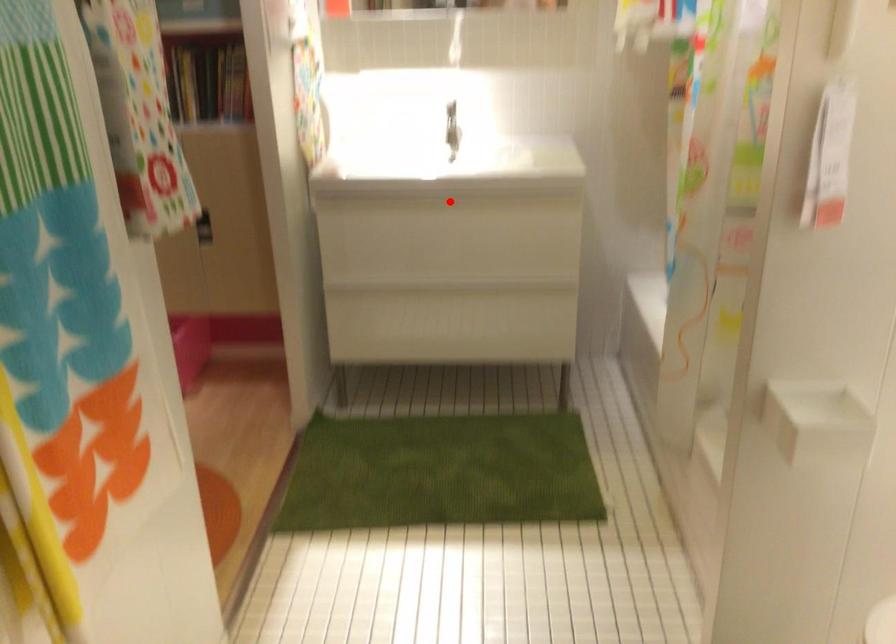
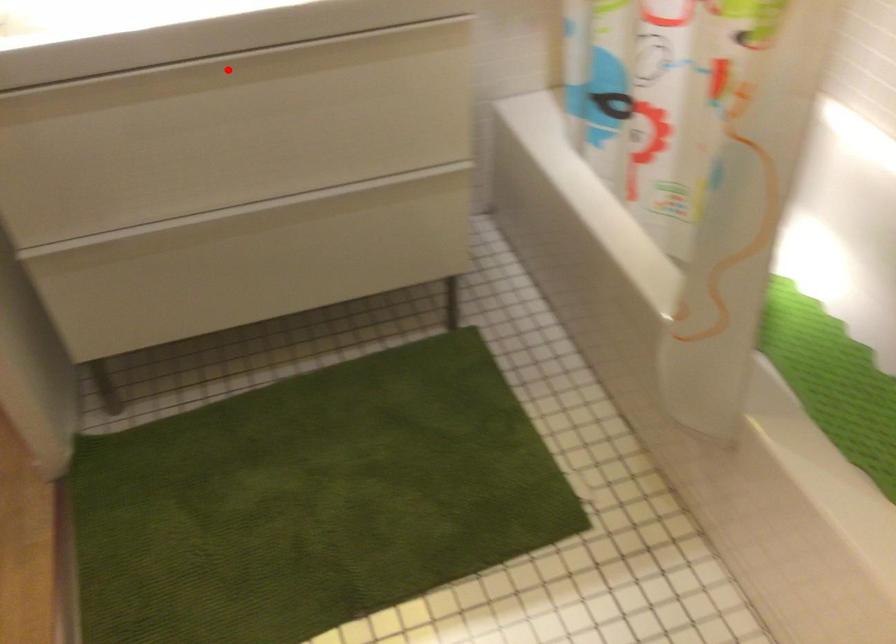
In the scene shown: I am providing you with two images of the same scene from different viewpoints. A red point is marked on the first image and another point is marked on the second image. Is the red point in image1 aligned with the point shown in image2?

Yes